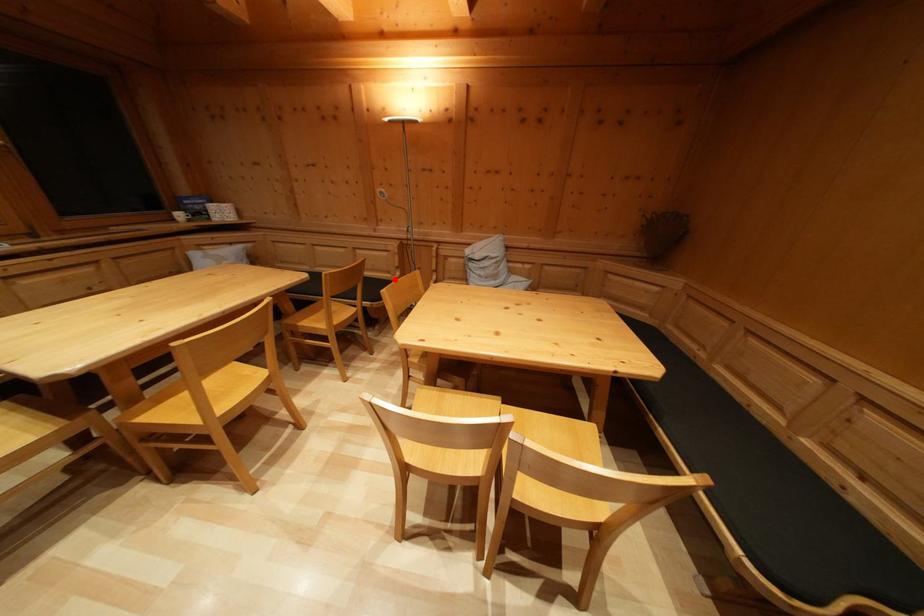
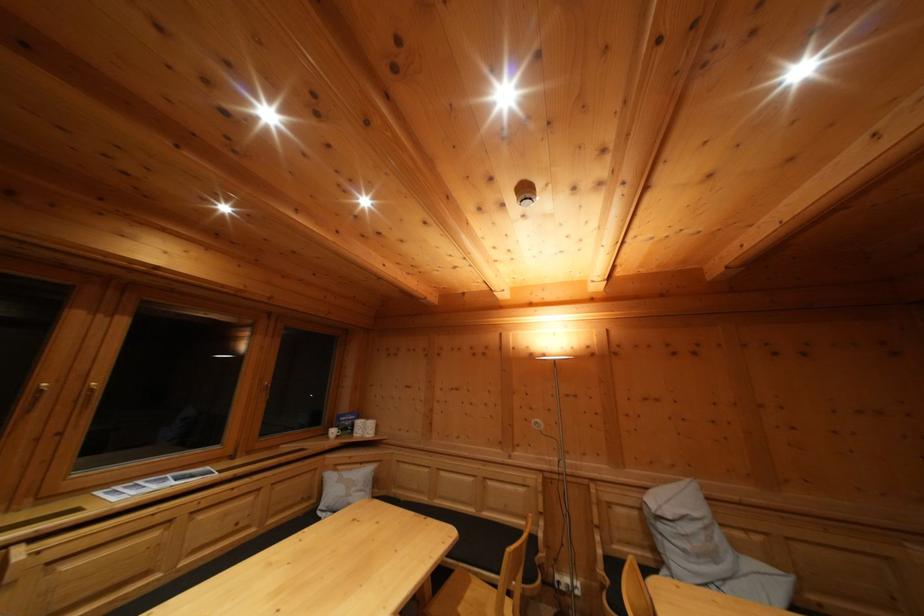
Find the pixel in the second image that matches the highlighted location in the first image.

(532, 525)